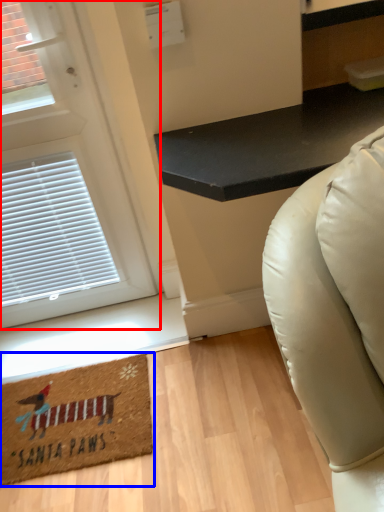
Question: Which point is closer to the camera, door (highlighted by a red box) or mat (highlighted by a blue box)?

Choices:
 (A) door
 (B) mat

Answer: (A)